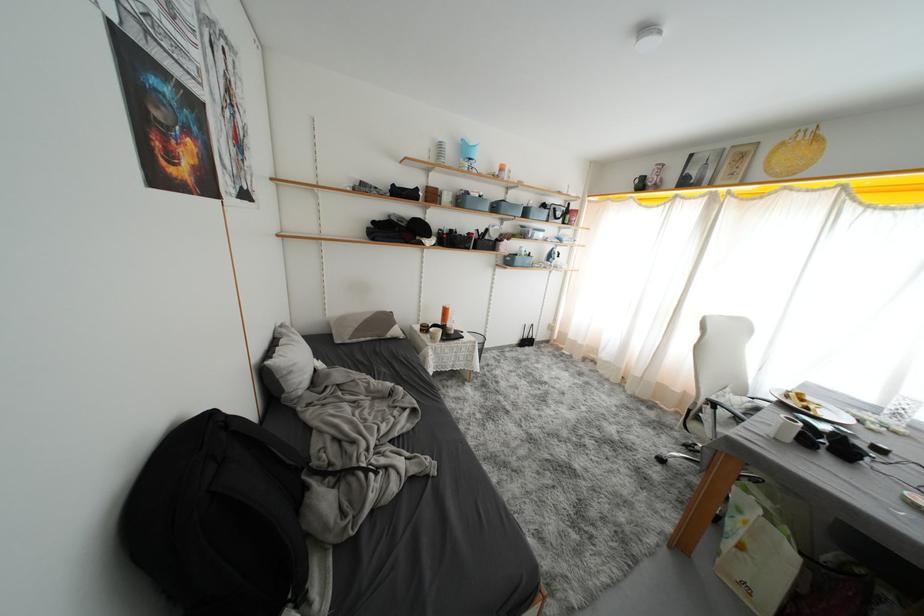
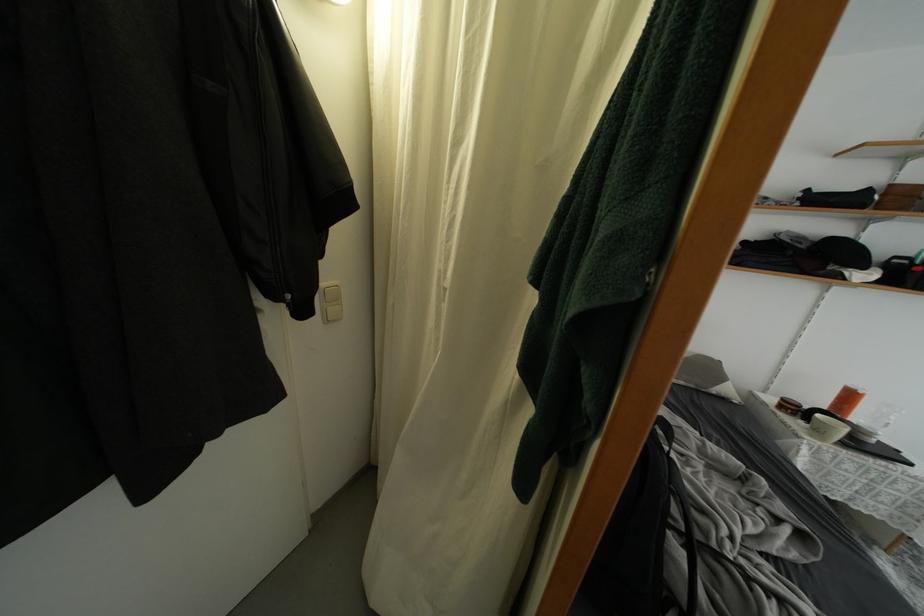
The point at (452, 315) is marked in the first image. Where is the corresponding point in the second image?

(856, 400)